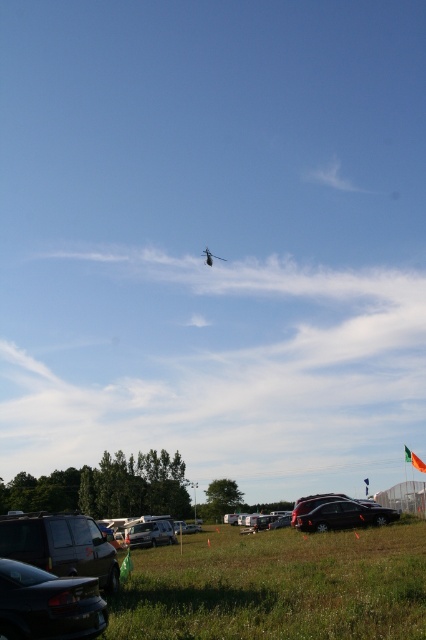
You are standing at the shiny black sedan at lower left and want to walk to the green grassy field at lower center. Which direction should you move?

The green grassy field at lower center is to the right of the shiny black sedan at lower left, so you should move to the right to reach it.